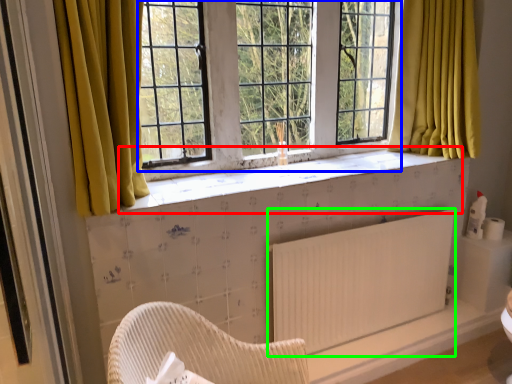
Question: Which object is positioned closest to window sill (highlighted by a red box)? Select from window screen (highlighted by a blue box) and radiator (highlighted by a green box).

Choices:
 (A) window screen
 (B) radiator

Answer: (A)